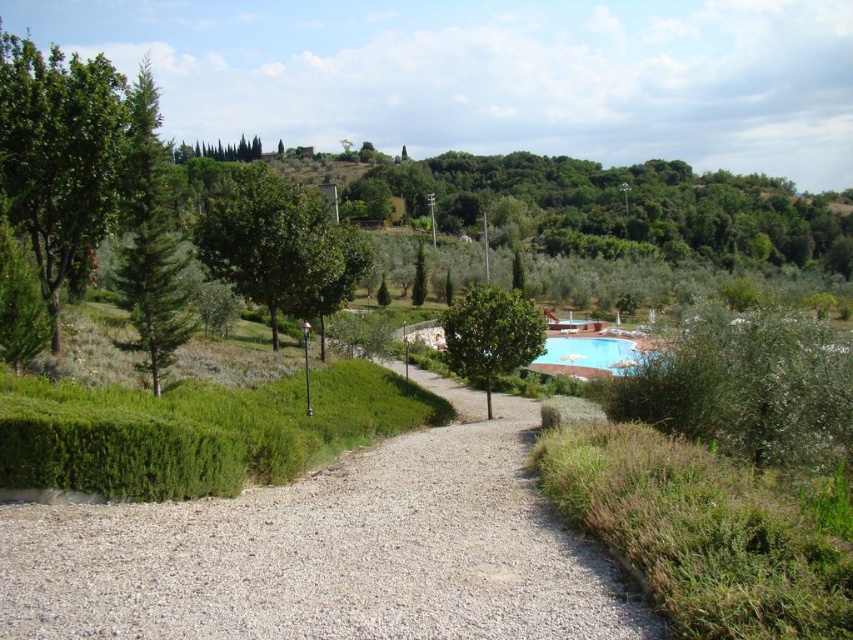
Between point (119, 182) and point (613, 340), which one is positioned behind?

Point (613, 340)

In order to click on green leafy tree at left in this screenshot , I will do `click(61, 157)`.

The width and height of the screenshot is (853, 640). Find the location of `green leafy tree at left`. green leafy tree at left is located at coordinates (61, 157).

Is green leafy tree at left closer to the viewer compared to green leafy olive tree at center-right?

Yes, green leafy tree at left is in front of green leafy olive tree at center-right.

Which of these two, green leafy tree at left or green leafy olive tree at center-right, stands shorter?

Standing shorter between the two is green leafy olive tree at center-right.

Between point (41, 204) and point (456, 342), which one is positioned behind?

Positioned behind is point (456, 342).

Locate an element on the screen. green leafy tree at left is located at coordinates (61, 157).

How far apart are green textured pine tree at left and blue glossy pool at center?

green textured pine tree at left and blue glossy pool at center are 214.00 feet apart from each other.

Does green textured pine tree at left have a lesser height compared to blue glossy pool at center?

In fact, green textured pine tree at left may be taller than blue glossy pool at center.

Is point (186, 317) positioned behind point (560, 356)?

No, (186, 317) is in front of (560, 356).

You are a GUI agent. You are given a task and a screenshot of the screen. Output one action in this format:
    pyautogui.click(x=<x>, y=<y>)
    Task: Click on the green textured pine tree at left
    This screenshot has height=640, width=853.
    Given the screenshot: What is the action you would take?
    pyautogui.click(x=151, y=243)